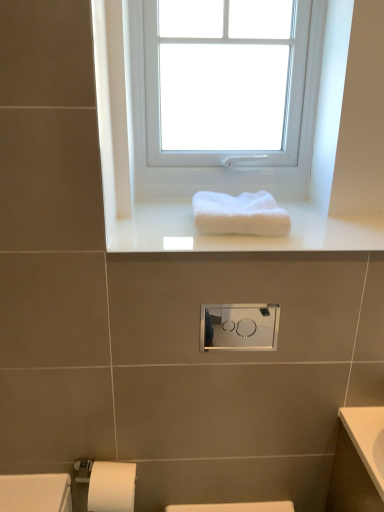
Question: Is white plastic window at upper center facing towards satin silver medicine cabinet at center?

Choices:
 (A) yes
 (B) no

Answer: (B)

Question: From a real-world perspective, is white plastic window at upper center physically below satin silver medicine cabinet at center?

Choices:
 (A) no
 (B) yes

Answer: (A)

Question: Considering the relative sizes of white plastic window at upper center and satin silver medicine cabinet at center in the image provided, is white plastic window at upper center smaller than satin silver medicine cabinet at center?

Choices:
 (A) no
 (B) yes

Answer: (A)

Question: Is white plastic window at upper center shorter than satin silver medicine cabinet at center?

Choices:
 (A) yes
 (B) no

Answer: (B)

Question: Does white plastic window at upper center appear on the left side of satin silver medicine cabinet at center?

Choices:
 (A) no
 (B) yes

Answer: (B)

Question: Considering the relative positions of white fluffy towel at center and white plastic window at upper center in the image provided, is white fluffy towel at center to the left or to the right of white plastic window at upper center?

Choices:
 (A) right
 (B) left

Answer: (A)

Question: Choose the correct answer: Is white fluffy towel at center inside white plastic window at upper center or outside it?

Choices:
 (A) outside
 (B) inside

Answer: (A)

Question: Does point pos(269,202) appear closer or farther from the camera than point pos(188,33)?

Choices:
 (A) closer
 (B) farther

Answer: (A)

Question: From a real-world perspective, is white fluffy towel at center positioned above or below white plastic window at upper center?

Choices:
 (A) above
 (B) below

Answer: (B)

Question: From a real-world perspective, is white glossy towel at upper center physically located above or below white fluffy towel at center?

Choices:
 (A) below
 (B) above

Answer: (A)

Question: Is white glossy towel at upper center inside or outside of white fluffy towel at center?

Choices:
 (A) inside
 (B) outside

Answer: (B)

Question: Considering the positions of white glossy towel at upper center and white fluffy towel at center in the image, is white glossy towel at upper center wider or thinner than white fluffy towel at center?

Choices:
 (A) thin
 (B) wide

Answer: (B)

Question: Considering their positions, is white glossy towel at upper center located in front of or behind white fluffy towel at center?

Choices:
 (A) behind
 (B) front

Answer: (B)

Question: From the image's perspective, is white fluffy towel at center above or below white glossy towel at upper center?

Choices:
 (A) above
 (B) below

Answer: (A)

Question: In terms of height, does white fluffy towel at center look taller or shorter compared to white glossy towel at upper center?

Choices:
 (A) short
 (B) tall

Answer: (B)